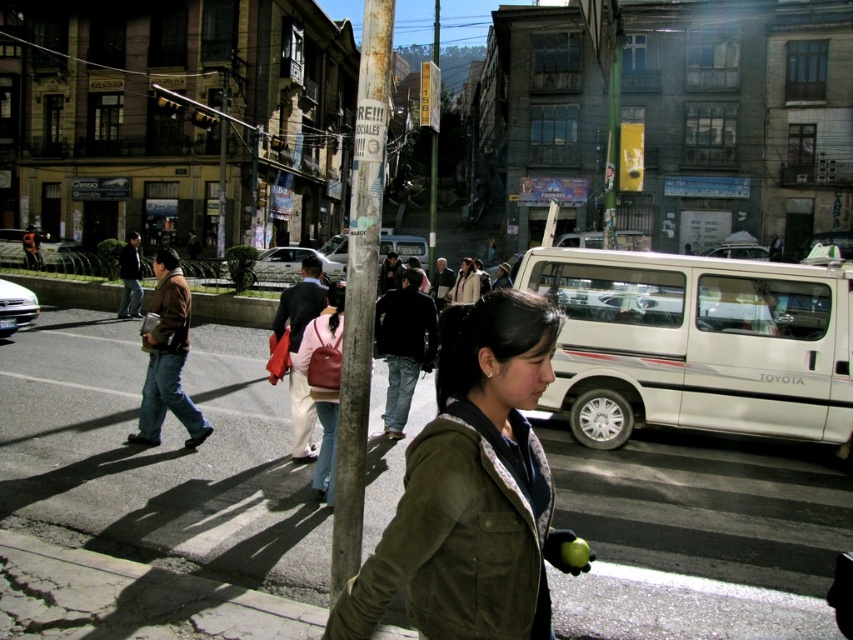
Question: In this image, where is brown leather jacket at left located relative to white glossy sedan at left?

Choices:
 (A) above
 (B) below

Answer: (A)

Question: Which object is positioned closest to the smooth asphalt road at center?

Choices:
 (A) brown leather jacket at left
 (B) white glossy sedan at left

Answer: (A)

Question: Can you confirm if white metallic van at right is bigger than white glossy sedan at left?

Choices:
 (A) no
 (B) yes

Answer: (B)

Question: Among these points, which one is farthest from the camera?

Choices:
 (A) (32, 300)
 (B) (517, 547)

Answer: (A)

Question: Is the position of smooth asphalt road at center less distant than that of green suede jacket at center?

Choices:
 (A) no
 (B) yes

Answer: (A)

Question: Which object is closer to the camera taking this photo?

Choices:
 (A) smooth asphalt road at center
 (B) white metallic van at right

Answer: (A)